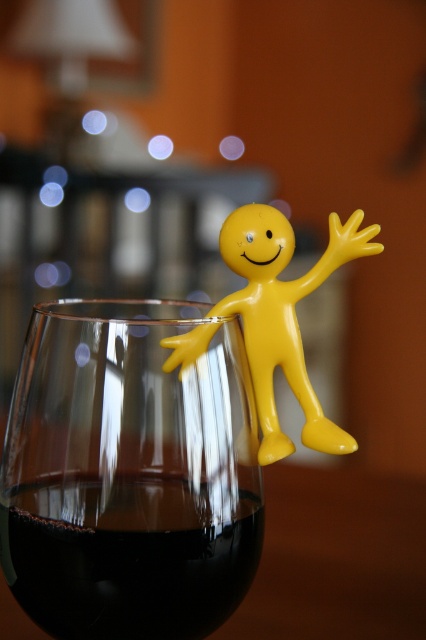
Can you confirm if transparent glass at upper center is wider than dark glass at center?

Yes, transparent glass at upper center is wider than dark glass at center.

Which is in front, point (95, 529) or point (233, 570)?

Point (95, 529) is in front.

Locate an element on the screen. This screenshot has width=426, height=640. transparent glass at upper center is located at coordinates (129, 474).

How much distance is there between dark glass at center and yellow matte figure at upper right?

7.85 centimeters

Is the position of dark glass at center more distant than that of yellow matte figure at upper right?

No, dark glass at center is closer to the viewer.

Is point (193, 532) positioned before point (218, 307)?

Yes, point (193, 532) is in front of point (218, 307).

Image resolution: width=426 pixels, height=640 pixels. I want to click on dark glass at center, so click(129, 573).

Where is `transparent glass at upper center`? This screenshot has height=640, width=426. transparent glass at upper center is located at coordinates (129, 474).

Is point (65, 582) closer to camera compared to point (301, 371)?

Yes.

Image resolution: width=426 pixels, height=640 pixels. What are the coordinates of `transparent glass at upper center` in the screenshot? It's located at (129, 474).